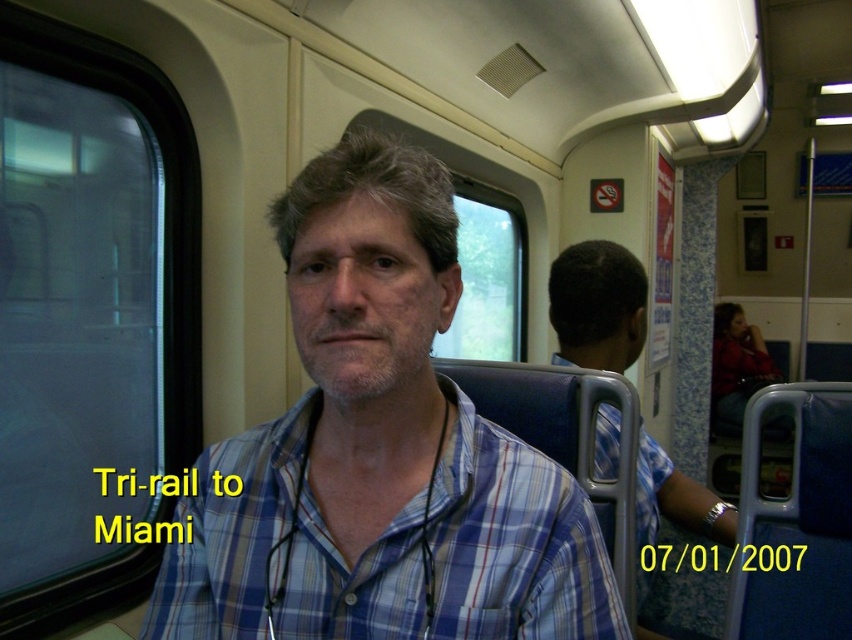
Question: Where is blue plaid shirt at center located in relation to blue plaid shirt at right in the image?

Choices:
 (A) left
 (B) right

Answer: (A)

Question: Which point appears farthest from the camera in this image?

Choices:
 (A) (183, 508)
 (B) (611, 353)

Answer: (B)

Question: Is blue plaid shirt at center wider than blue plaid shirt at right?

Choices:
 (A) no
 (B) yes

Answer: (B)

Question: Can you confirm if blue plaid shirt at center is positioned below blue plaid shirt at right?

Choices:
 (A) yes
 (B) no

Answer: (B)